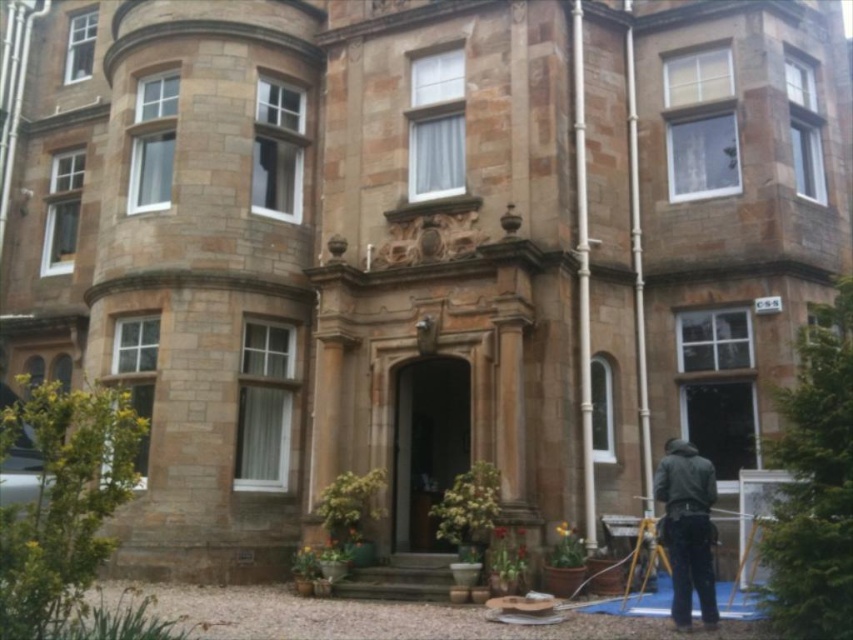
Is dark gray jacket at lower right behind yellow metallic tripod at lower right?

No, it is not.

Does dark gray jacket at lower right appear on the right side of yellow metallic tripod at lower right?

Indeed, dark gray jacket at lower right is positioned on the right side of yellow metallic tripod at lower right.

Is point (688, 490) farther from camera compared to point (648, 561)?

That is False.

Where is `dark gray jacket at lower right`? The image size is (853, 640). dark gray jacket at lower right is located at coordinates (688, 529).